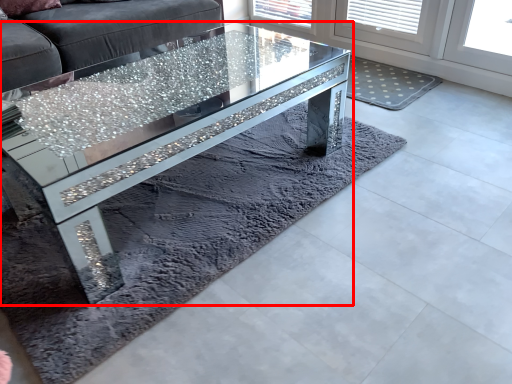
Question: From the image's perspective, considering the relative positions of coffee table (annotated by the red box) and glass table in the image provided, where is coffee table (annotated by the red box) located with respect to the staircase?

Choices:
 (A) below
 (B) above

Answer: (A)